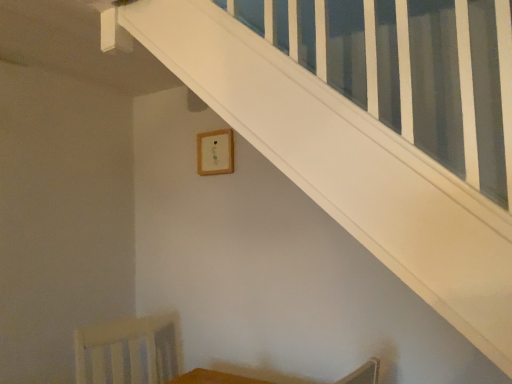
Question: Considering the positions of wooden frame at upper center and wooden table at lower center in the image, is wooden frame at upper center wider or thinner than wooden table at lower center?

Choices:
 (A) thin
 (B) wide

Answer: (A)

Question: Is wooden frame at upper center to the left or to the right of wooden table at lower center in the image?

Choices:
 (A) left
 (B) right

Answer: (A)

Question: Which object is the closest to the wooden frame at upper center?

Choices:
 (A) wooden table at lower center
 (B) white wood swivel chair at lower left

Answer: (B)

Question: Which is farther from the wooden table at lower center?

Choices:
 (A) white wood swivel chair at lower left
 (B) wooden frame at upper center

Answer: (B)